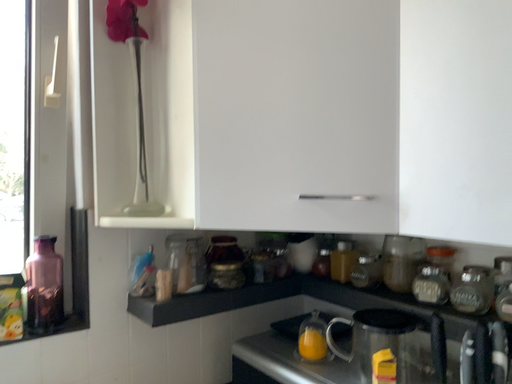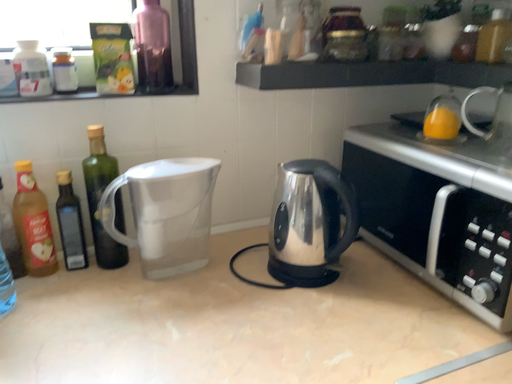
Question: How did the camera likely rotate when shooting the video?

Choices:
 (A) rotated downward
 (B) rotated upward

Answer: (A)